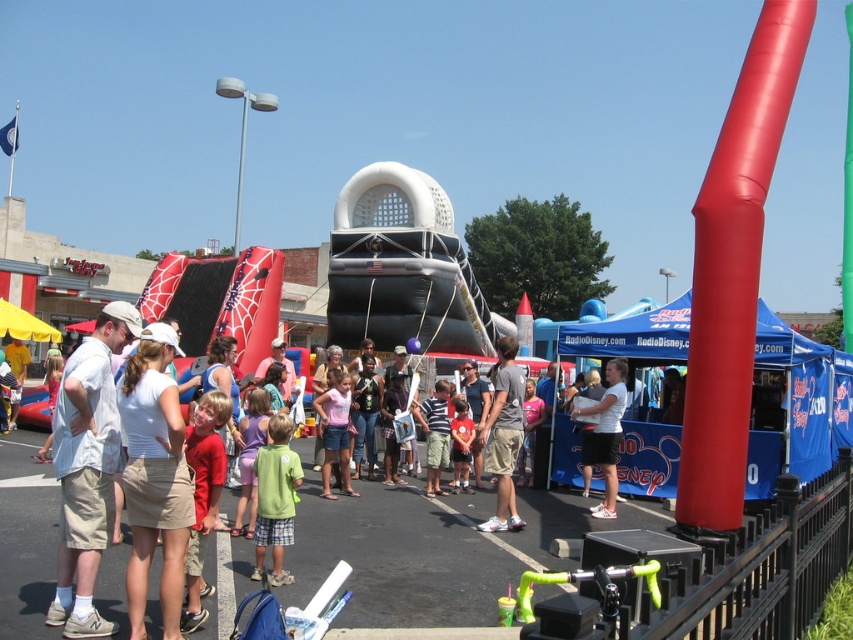
Question: Does green matte shirt at center have a lesser width compared to khaki shorts at center?

Choices:
 (A) no
 (B) yes

Answer: (B)

Question: Considering the relative positions of white cotton shirt at left and white matte shirt at center in the image provided, where is white cotton shirt at left located with respect to white matte shirt at center?

Choices:
 (A) right
 (B) left

Answer: (B)

Question: Does white cotton shirt at left appear over khaki shorts at center?

Choices:
 (A) yes
 (B) no

Answer: (B)

Question: Which point is farther from the camera taking this photo?

Choices:
 (A) (84, 364)
 (B) (277, 486)
 (C) (613, 365)
 (D) (514, 417)

Answer: (C)

Question: Estimate the real-world distances between objects in this image. Which object is closer to the green matte shirt at center?

Choices:
 (A) red shirt at center
 (B) white matte shirt at center

Answer: (A)

Question: Which object is positioned farthest from the white matte shirt at center?

Choices:
 (A) red shirt at center
 (B) green matte shirt at center

Answer: (B)